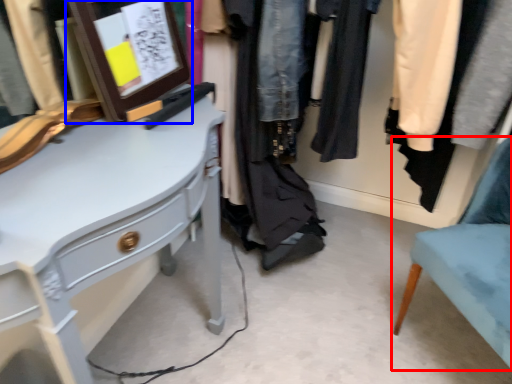
Question: Which of the following is the closest to the observer, chair (highlighted by a red box) or picture frame (highlighted by a blue box)?

Choices:
 (A) chair
 (B) picture frame

Answer: (A)